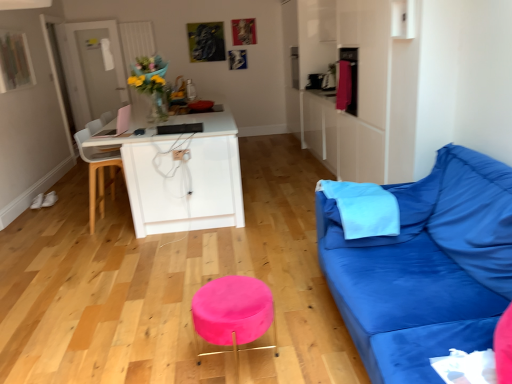
Question: Is light blue fabric pillow at right, the 2th pillow positioned from the right, situated inside pink velvet stool at center or outside?

Choices:
 (A) inside
 (B) outside

Answer: (B)

Question: From the image's perspective, relative to pink velvet stool at center, is light blue fabric pillow at right, arranged as the 1th pillow when viewed from the left, above or below?

Choices:
 (A) below
 (B) above

Answer: (B)

Question: Considering the real-world distances, which object is farthest from the blue fabric couch at right?

Choices:
 (A) white plastic chair at left
 (B) light blue fabric pillow at right, the 2th pillow positioned from the right
 (C) pink velvet stool at center
 (D) blue fabric pillow at right, the 2th pillow positioned from the left

Answer: (A)

Question: Based on their relative distances, which object is farther from the pink velvet stool at center?

Choices:
 (A) blue fabric couch at right
 (B) light blue fabric pillow at right, the 2th pillow positioned from the right
 (C) blue fabric pillow at right, the 2th pillow positioned from the left
 (D) white plastic chair at left

Answer: (D)